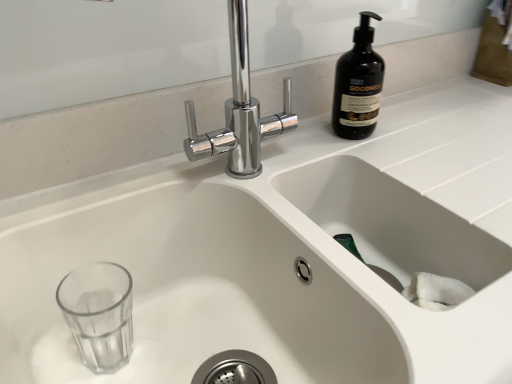
Based on the photo, what is the approximate height of transparent glass at left?

6.56 inches.

The image size is (512, 384). Find the location of `transparent glass at left`. transparent glass at left is located at coordinates [x=190, y=292].

What do you see at coordinates (190, 292) in the screenshot? The image size is (512, 384). I see `transparent glass at left` at bounding box center [190, 292].

Where is `transparent glass at left`? The image size is (512, 384). transparent glass at left is located at coordinates (190, 292).